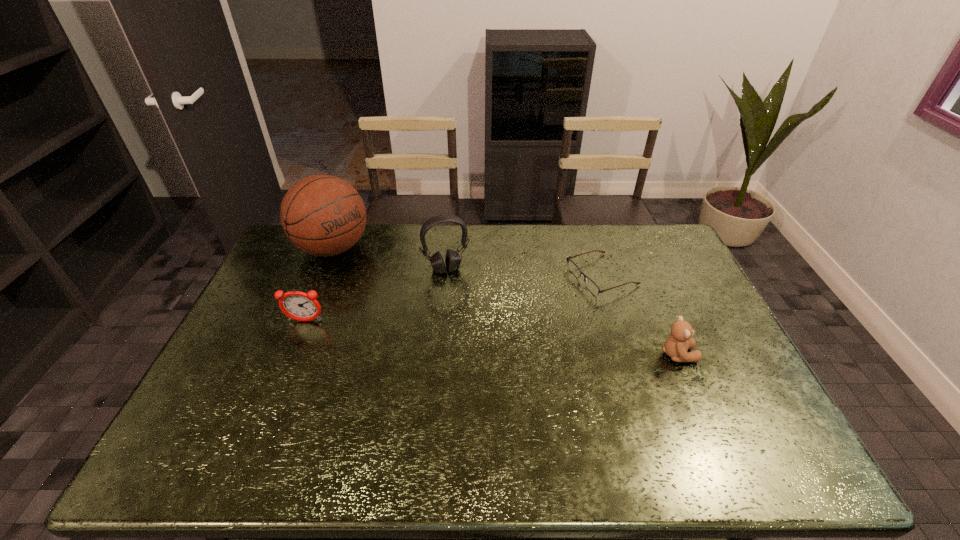
The image size is (960, 540). In order to click on vacant area that lies between the nearest object and the shortest object in this screenshot , I will do `click(639, 315)`.

Locate which object is the closest to the spectacles. Please provide its 2D coordinates. Your answer should be formatted as a tuple, i.e. [(x, y)], where the tuple contains the x and y coordinates of a point satisfying the conditions above.

[(676, 346)]

Where is `object that stands as the fourth closest to the alarm clock`? This screenshot has height=540, width=960. object that stands as the fourth closest to the alarm clock is located at coordinates (676, 346).

Locate an element on the screen. This screenshot has height=540, width=960. free space in the image that satisfies the following two spatial constraints: 1. on the front-facing side of the fourth farthest object; 2. on the face of the nearest object is located at coordinates (292, 355).

The image size is (960, 540). Find the location of `vacant point that satisfies the following two spatial constraints: 1. on the front-facing side of the second nearest object; 2. on the face of the nearest object`. vacant point that satisfies the following two spatial constraints: 1. on the front-facing side of the second nearest object; 2. on the face of the nearest object is located at coordinates (292, 355).

I want to click on free point that satisfies the following two spatial constraints: 1. on the front-facing side of the teddy bear; 2. on the face of the fourth farthest object, so click(x=292, y=355).

Locate an element on the screen. This screenshot has width=960, height=540. vacant space that satisfies the following two spatial constraints: 1. on the front side of the teddy bear; 2. on the face of the tallest object is located at coordinates (289, 355).

Where is `vacant space that satisfies the following two spatial constraints: 1. on the front-facing side of the alarm clock; 2. on the face of the nearest object`? The height and width of the screenshot is (540, 960). vacant space that satisfies the following two spatial constraints: 1. on the front-facing side of the alarm clock; 2. on the face of the nearest object is located at coordinates (292, 355).

I want to click on vacant space that satisfies the following two spatial constraints: 1. on the front-facing side of the teddy bear; 2. on the face of the second nearest object, so [292, 355].

You are a GUI agent. You are given a task and a screenshot of the screen. Output one action in this format:
    pyautogui.click(x=<x>, y=<y>)
    Task: Click on the vacant space that satisfies the following two spatial constraints: 1. on the front side of the nearest object; 2. on the face of the spectacles
    Image resolution: width=960 pixels, height=540 pixels.
    Given the screenshot: What is the action you would take?
    pyautogui.click(x=627, y=355)